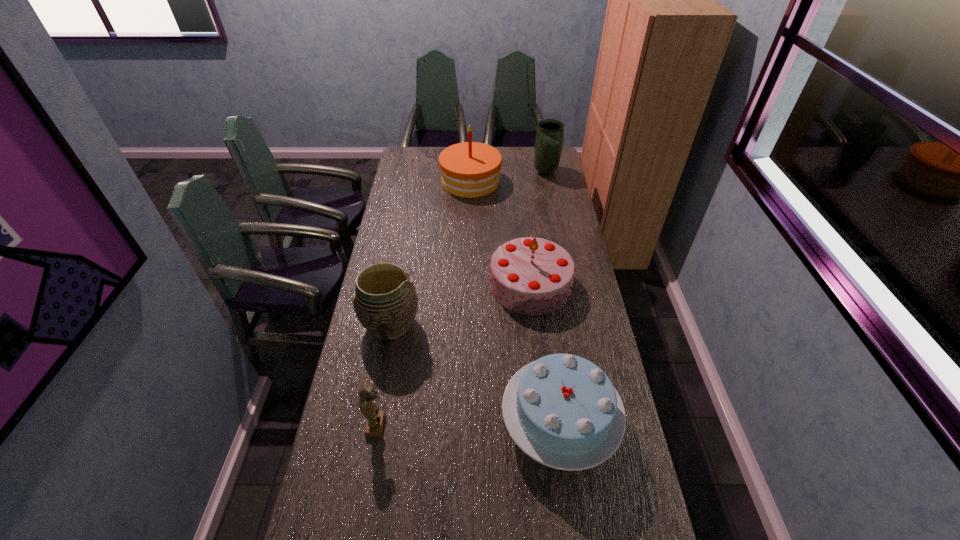
Where is `the farthest birthday cake`? This screenshot has width=960, height=540. the farthest birthday cake is located at coordinates (470, 169).

Locate an element on the screen. Image resolution: width=960 pixels, height=540 pixels. vase is located at coordinates (549, 138).

Where is `pottery`? pottery is located at coordinates (385, 302).

I want to click on the second farthest birthday cake, so click(533, 276).

Find the location of a particular element. This screenshot has width=960, height=540. figurine is located at coordinates (367, 391).

Locate an element on the screen. The width and height of the screenshot is (960, 540). the nearest birthday cake is located at coordinates (562, 410).

This screenshot has height=540, width=960. I want to click on vacant space situated on the front of the tallest birthday cake, so 469,226.

At what (x,y) coordinates should I click in order to perform the action: click on blank space located 0.120m on the back of the vase. Please return your answer as a coordinate pair (x, y). The width and height of the screenshot is (960, 540). Looking at the image, I should click on (541, 152).

The width and height of the screenshot is (960, 540). I want to click on free space located on the front of the pottery, so click(x=384, y=363).

Locate an element on the screen. Image resolution: width=960 pixels, height=540 pixels. vacant space located 0.400m on the front of the second farthest birthday cake is located at coordinates (545, 416).